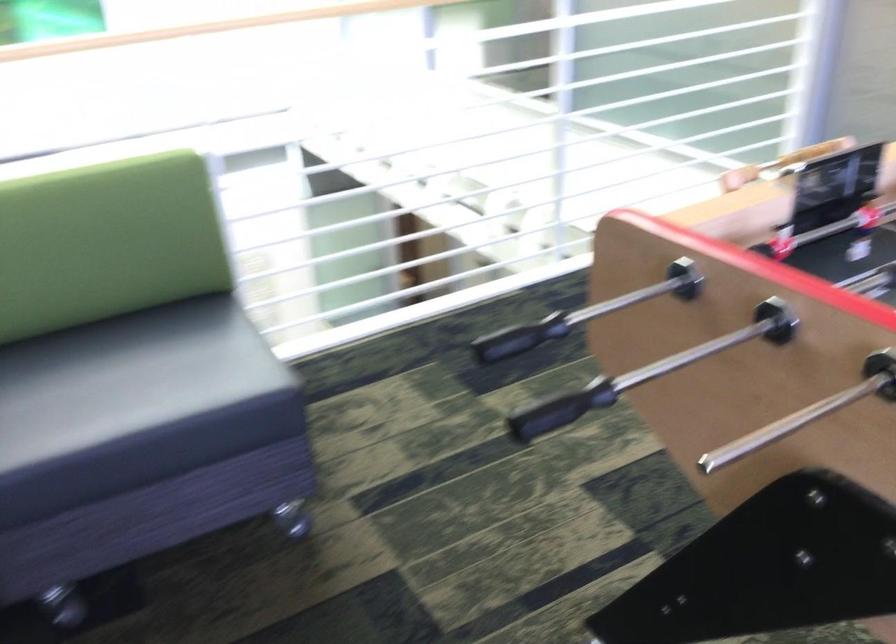
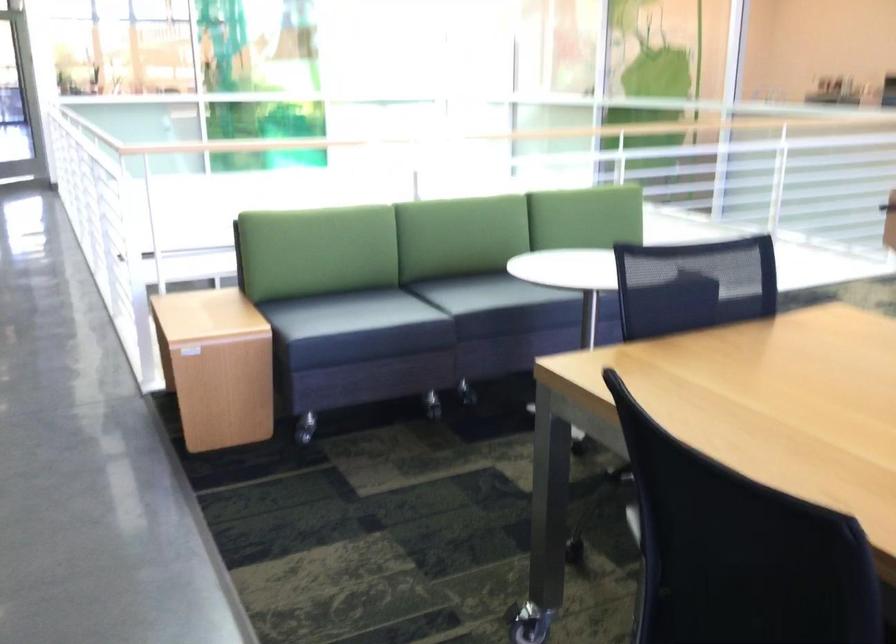
In a continuous first-person perspective shot, in which direction is the camera moving?

The cameraman walked toward left, backward.